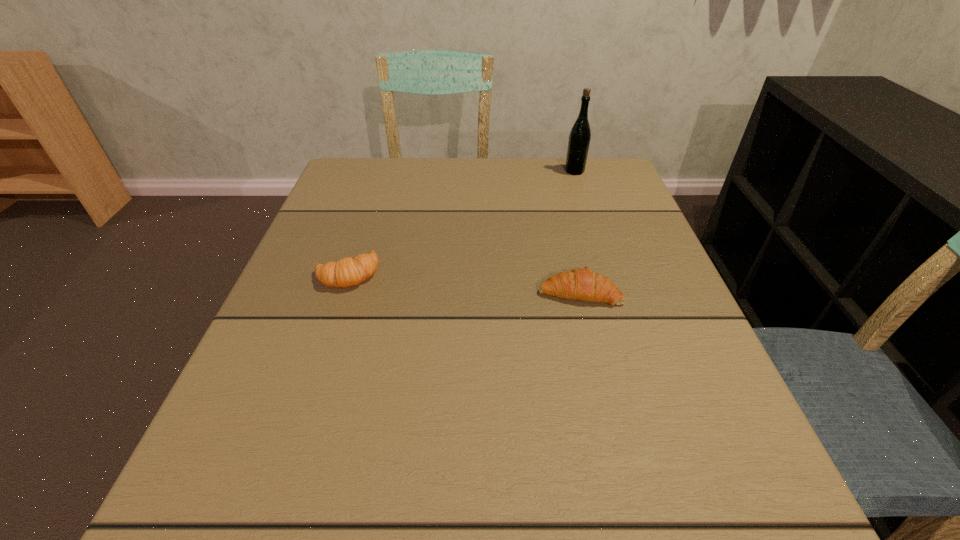
This screenshot has height=540, width=960. Identify the location of crescent roll at the right edge. (583, 284).

Locate an element on the screen. This screenshot has width=960, height=540. object present at the far right corner is located at coordinates (579, 139).

Image resolution: width=960 pixels, height=540 pixels. In order to click on blank space at the far edge of the desktop in this screenshot , I will do `click(438, 176)`.

In the image, there is a desktop. Identify the location of free space at the near edge. (467, 488).

Where is `free region at the left edge of the desktop`? free region at the left edge of the desktop is located at coordinates (363, 316).

Where is `vacant space at the near left corner of the desktop`? The image size is (960, 540). vacant space at the near left corner of the desktop is located at coordinates (275, 503).

Where is `free space at the far right corner of the desktop`? This screenshot has width=960, height=540. free space at the far right corner of the desktop is located at coordinates (604, 191).

Where is `vacant space at the near right corner of the desktop`? vacant space at the near right corner of the desktop is located at coordinates click(765, 509).

Find the location of `empty space that is in between the farthest object and the right crescent roll`. empty space that is in between the farthest object and the right crescent roll is located at coordinates (577, 232).

Where is `empty space that is in between the left crescent roll and the farthest object`? Image resolution: width=960 pixels, height=540 pixels. empty space that is in between the left crescent roll and the farthest object is located at coordinates (461, 222).